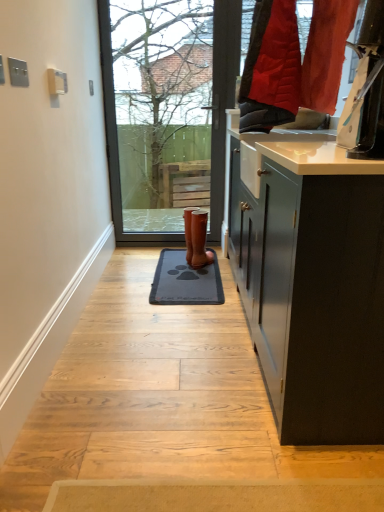
Question: Considering the relative sizes of bare branches at upper center and dark gray rubber doormat at center in the image provided, is bare branches at upper center thinner than dark gray rubber doormat at center?

Choices:
 (A) no
 (B) yes

Answer: (B)

Question: Is bare branches at upper center positioned far away from dark gray rubber doormat at center?

Choices:
 (A) no
 (B) yes

Answer: (B)

Question: From a real-world perspective, is bare branches at upper center positioned under dark gray rubber doormat at center based on gravity?

Choices:
 (A) yes
 (B) no

Answer: (B)

Question: Is bare branches at upper center to the left of dark gray rubber doormat at center from the viewer's perspective?

Choices:
 (A) no
 (B) yes

Answer: (B)

Question: Is bare branches at upper center further to camera compared to dark gray rubber doormat at center?

Choices:
 (A) no
 (B) yes

Answer: (B)

Question: From their relative heights in the image, would you say brown leather boot at center is taller or shorter than dark gray rubber doormat at center?

Choices:
 (A) short
 (B) tall

Answer: (B)

Question: Considering their positions, is brown leather boot at center located in front of or behind dark gray rubber doormat at center?

Choices:
 (A) front
 (B) behind

Answer: (B)

Question: Is point (203, 222) positioned closer to the camera than point (160, 264)?

Choices:
 (A) closer
 (B) farther

Answer: (B)

Question: In terms of width, does brown leather boot at center look wider or thinner when compared to dark gray rubber doormat at center?

Choices:
 (A) wide
 (B) thin

Answer: (B)

Question: From their relative heights in the image, would you say dark gray rubber doormat at center is taller or shorter than brown leather boot at center?

Choices:
 (A) short
 (B) tall

Answer: (A)

Question: Visually, is dark gray rubber doormat at center positioned to the left or to the right of brown leather boot at center?

Choices:
 (A) left
 (B) right

Answer: (A)

Question: Is point (196, 274) closer or farther from the camera than point (196, 246)?

Choices:
 (A) closer
 (B) farther

Answer: (A)

Question: Relative to brown leather boot at center, is dark gray rubber doormat at center in front or behind?

Choices:
 (A) front
 (B) behind

Answer: (A)

Question: In terms of size, does brown leather boot at center appear bigger or smaller than bare branches at upper center?

Choices:
 (A) small
 (B) big

Answer: (A)

Question: From the image's perspective, relative to bare branches at upper center, is brown leather boot at center above or below?

Choices:
 (A) below
 (B) above

Answer: (A)